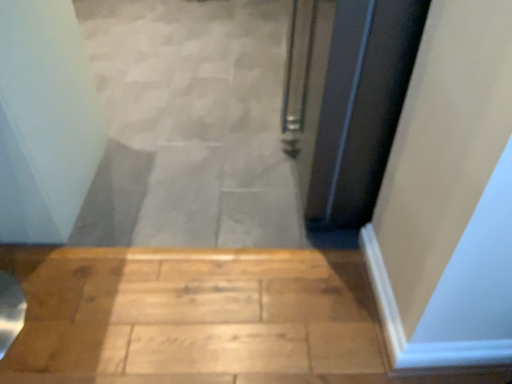
Question: Is smooth concrete stairs at center bigger than black glossy door at upper right?

Choices:
 (A) no
 (B) yes

Answer: (A)

Question: From a real-world perspective, is smooth concrete stairs at center under black glossy door at upper right?

Choices:
 (A) yes
 (B) no

Answer: (A)

Question: Considering the relative positions of smooth concrete stairs at center and black glossy door at upper right in the image provided, is smooth concrete stairs at center in front of black glossy door at upper right?

Choices:
 (A) yes
 (B) no

Answer: (B)

Question: Is smooth concrete stairs at center oriented towards black glossy door at upper right?

Choices:
 (A) no
 (B) yes

Answer: (A)

Question: From a real-world perspective, does smooth concrete stairs at center stand above black glossy door at upper right?

Choices:
 (A) yes
 (B) no

Answer: (B)

Question: Can you confirm if smooth concrete stairs at center is wider than black glossy door at upper right?

Choices:
 (A) no
 (B) yes

Answer: (B)

Question: Is smooth concrete stairs at center located within black glossy door at upper right?

Choices:
 (A) yes
 (B) no

Answer: (B)

Question: Is black glossy door at upper right not close to smooth concrete stairs at center?

Choices:
 (A) yes
 (B) no

Answer: (B)

Question: Can you confirm if black glossy door at upper right is wider than smooth concrete stairs at center?

Choices:
 (A) no
 (B) yes

Answer: (A)

Question: Is black glossy door at upper right aimed at smooth concrete stairs at center?

Choices:
 (A) no
 (B) yes

Answer: (A)

Question: Is black glossy door at upper right further to the viewer compared to smooth concrete stairs at center?

Choices:
 (A) no
 (B) yes

Answer: (A)

Question: Considering the relative sizes of black glossy door at upper right and smooth concrete stairs at center in the image provided, is black glossy door at upper right smaller than smooth concrete stairs at center?

Choices:
 (A) yes
 (B) no

Answer: (B)

Question: Is smooth concrete stairs at center bigger or smaller than black glossy door at upper right?

Choices:
 (A) small
 (B) big

Answer: (A)